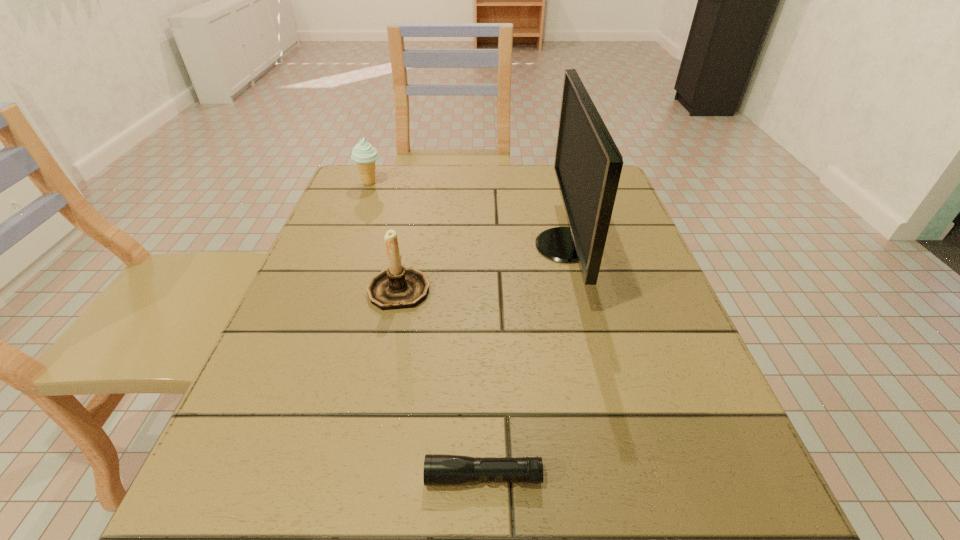
At what (x,y) coordinates should I click in order to perform the action: click on free space that is in between the tallest object and the second tallest object. Please return your answer as a coordinate pair (x, y). This screenshot has width=960, height=540. Looking at the image, I should click on (482, 266).

The width and height of the screenshot is (960, 540). I want to click on vacant space that's between the shortest object and the farthest object, so click(426, 330).

Image resolution: width=960 pixels, height=540 pixels. Identify the location of vacant space that's between the icecream and the second object from right to left. (426, 330).

In order to click on unoccupied area between the flashlight and the tallest object in this screenshot , I will do `click(524, 361)`.

I want to click on vacant region between the second object from left to right and the flashlight, so click(442, 382).

I want to click on empty space that is in between the nearest object and the second shortest object, so click(x=426, y=330).

Where is `free space that is in between the nearest object and the second tallest object`? free space that is in between the nearest object and the second tallest object is located at coordinates (442, 382).

Locate an element on the screen. vacant area that lies between the second tallest object and the tallest object is located at coordinates (482, 266).

This screenshot has height=540, width=960. Find the location of `empty location between the rightmost object and the third shortest object`. empty location between the rightmost object and the third shortest object is located at coordinates (482, 266).

Where is `free space between the third object from right to left and the computer monitor`? The width and height of the screenshot is (960, 540). free space between the third object from right to left and the computer monitor is located at coordinates (482, 266).